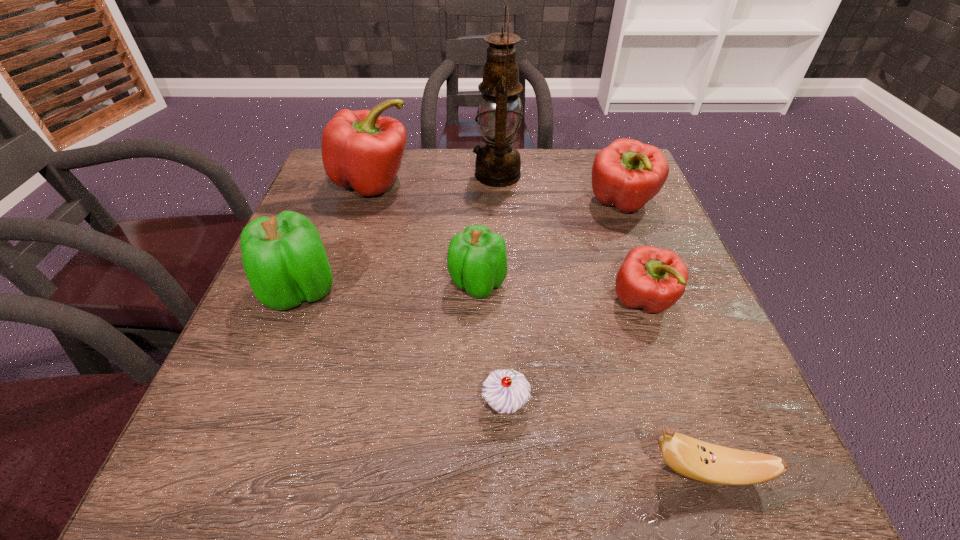
Identify the location of bell pepper object that ranks as the third closest to the right green bell pepper. (360, 149).

Locate an element on the screen. bell pepper identified as the fourth closest to the brown oil lamp is located at coordinates (654, 279).

Choose which pink bell pepper is the second nearest neighbor to the cupcake. Please provide its 2D coordinates. Your answer should be formatted as a tuple, i.e. [(x, y)], where the tuple contains the x and y coordinates of a point satisfying the conditions above.

[(627, 174)]

Where is `pink bell pepper that can be found as the second closest to the cupcake`? The width and height of the screenshot is (960, 540). pink bell pepper that can be found as the second closest to the cupcake is located at coordinates (627, 174).

Where is `vacant space that satisfies the following two spatial constraints: 1. on the front side of the nearest pink bell pepper; 2. on the right side of the brown oil lamp`? Image resolution: width=960 pixels, height=540 pixels. vacant space that satisfies the following two spatial constraints: 1. on the front side of the nearest pink bell pepper; 2. on the right side of the brown oil lamp is located at coordinates (503, 302).

Identify the location of vacant space that satisfies the following two spatial constraints: 1. on the front side of the leftmost pink bell pepper; 2. on the left side of the banana. pyautogui.click(x=283, y=471).

At what (x,y) coordinates should I click in order to perform the action: click on vacant space that satisfies the following two spatial constraints: 1. on the front side of the right green bell pepper; 2. on the right side of the gray cupcake. Please return your answer as a coordinate pair (x, y). Image resolution: width=960 pixels, height=540 pixels. Looking at the image, I should click on (476, 404).

I want to click on vacant region that satisfies the following two spatial constraints: 1. on the front side of the gray cupcake; 2. on the right side of the leftmost pink bell pepper, so click(304, 404).